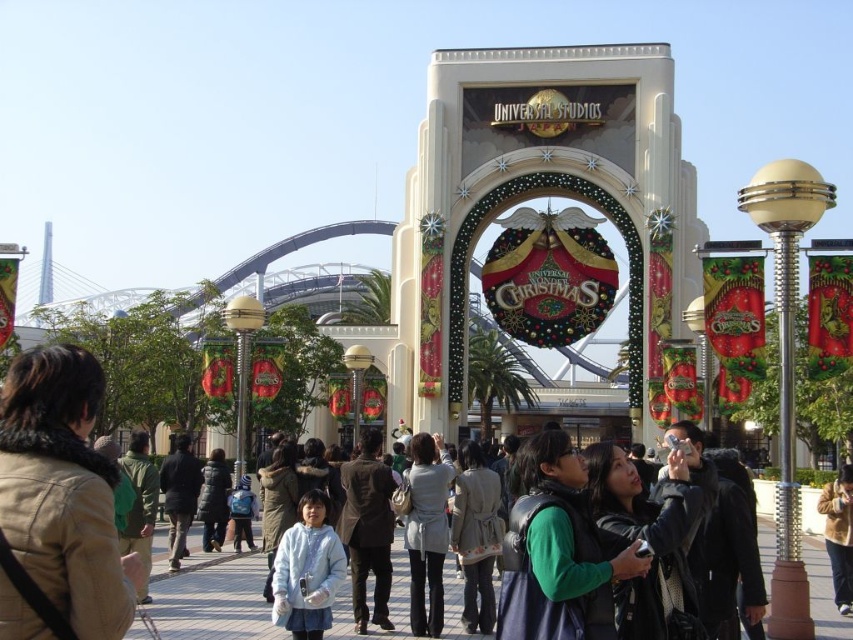
You are a photographer at Universal Studios Japan and want to capture both the light blue denim jacket at center and the white fleece jacket at center in a single frame. Given that your camera has a fixed focal length, which jacket should you position closer to the camera to ensure both fit in the frame without cropping?

To ensure both the light blue denim jacket at center and the white fleece jacket at center fit in the frame without cropping, position the wider light blue denim jacket at center closer to the camera since it is larger in width than the white fleece jacket at center. This way, both jackets will appear proportionally sized within the frame.

You are a photographer at Universal Studios Japan and need to capture a group photo of two people wearing the dark brown suit at center and the white fleece jacket at center. The camera frame can only accommodate a total width of 1.5 meters. Can both individuals fit side by side within the frame?

The dark brown suit at center has a larger width than the white fleece jacket at center. However, since the total width of both items combined is not provided, it is impossible to determine if they can fit within the 1.5 meter frame. Additional information about their individual widths is needed to make an accurate assessment.